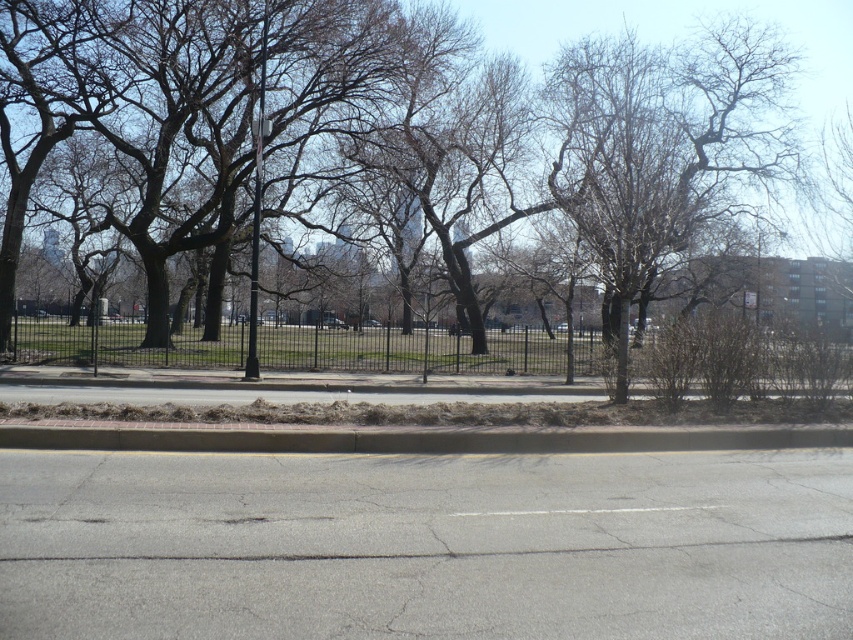
Question: Is bare branches at center in front of asphalt road at center?

Choices:
 (A) yes
 (B) no

Answer: (B)

Question: Among these points, which one is farthest from the camera?

Choices:
 (A) (793, 67)
 (B) (538, 160)

Answer: (B)

Question: Estimate the real-world distances between objects in this image. Which object is farther from the brown concrete curb at lower center?

Choices:
 (A) white asphalt line at center
 (B) black metal fence at center

Answer: (B)

Question: Which object is the closest to the black metal fence at center?

Choices:
 (A) brown bark tree at left
 (B) white asphalt line at center
 (C) asphalt road at center

Answer: (A)

Question: Can you confirm if brown concrete curb at lower center is bigger than asphalt road at center?

Choices:
 (A) no
 (B) yes

Answer: (B)

Question: Where is bare branches at center located in relation to black metal fence at center in the image?

Choices:
 (A) above
 (B) below

Answer: (A)